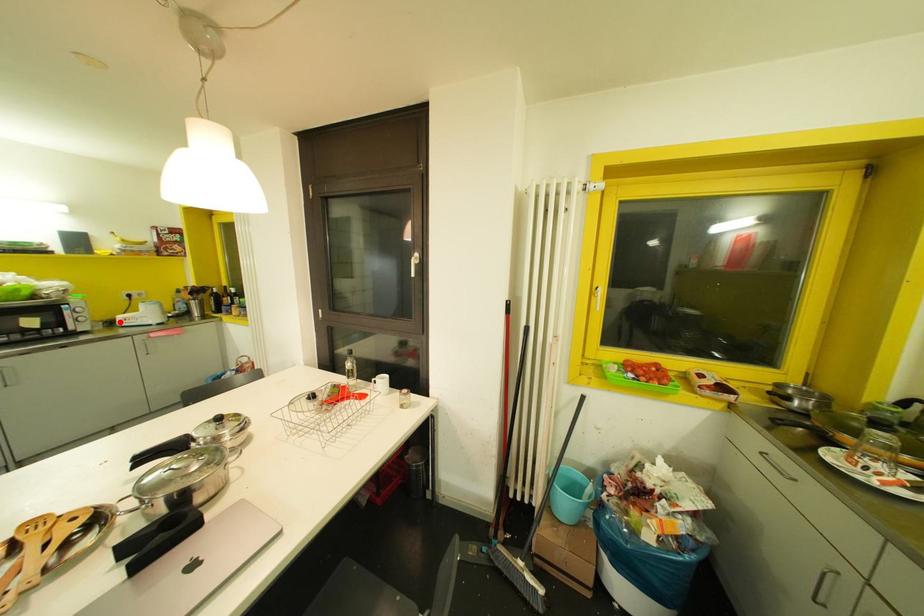
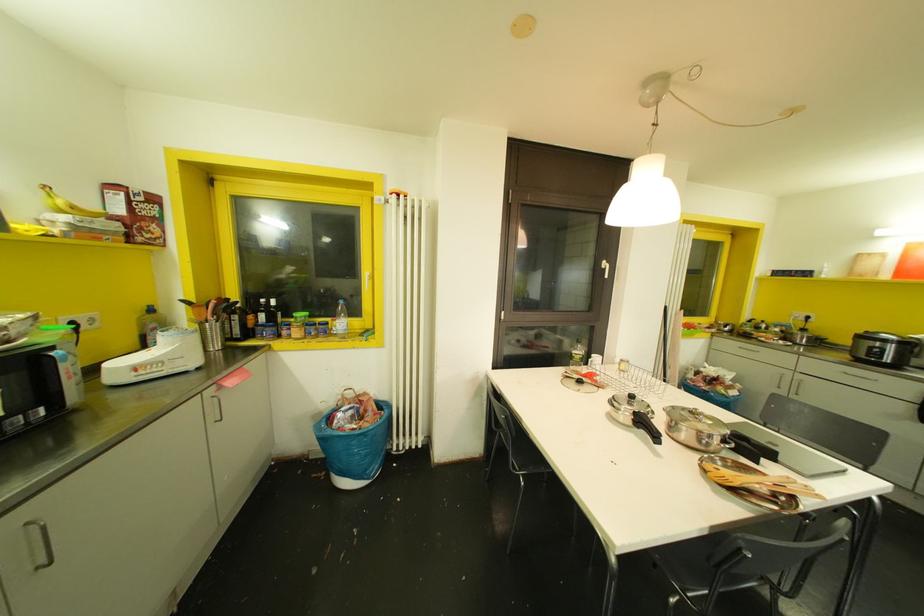
Locate, in the second image, the point that corresponds to the highlighted location in the first image.

(116, 378)